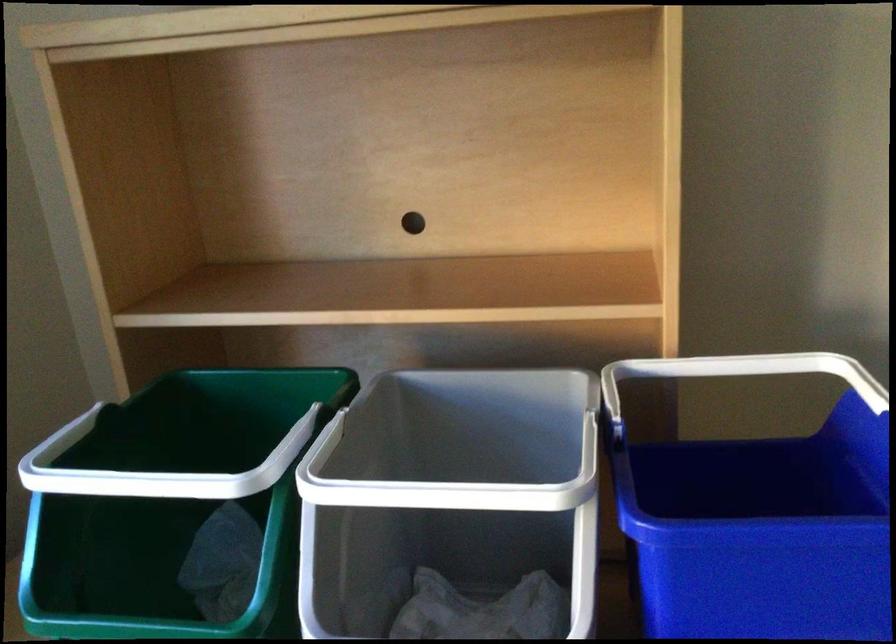
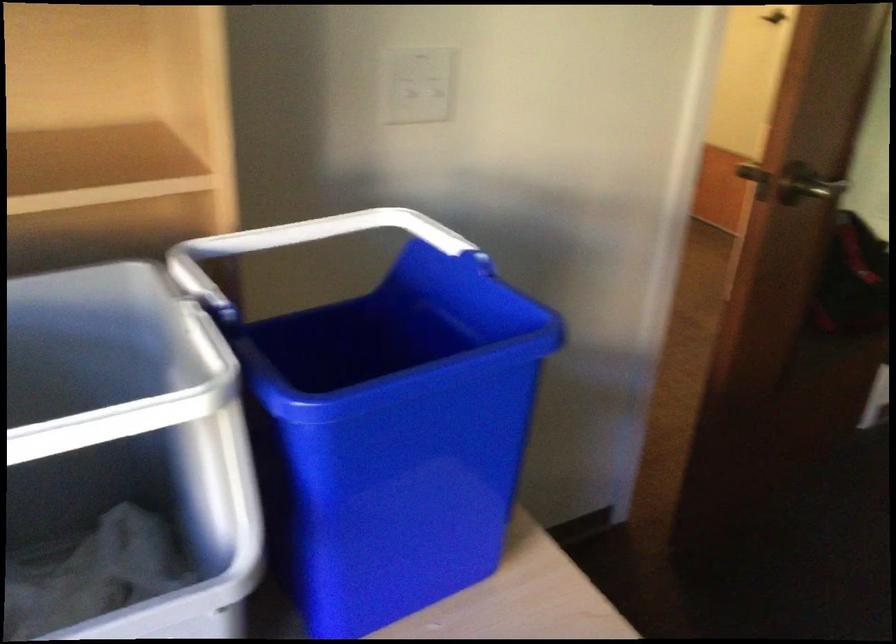
In the second image, find the point that corresponds to [642,372] in the first image.

(213, 257)